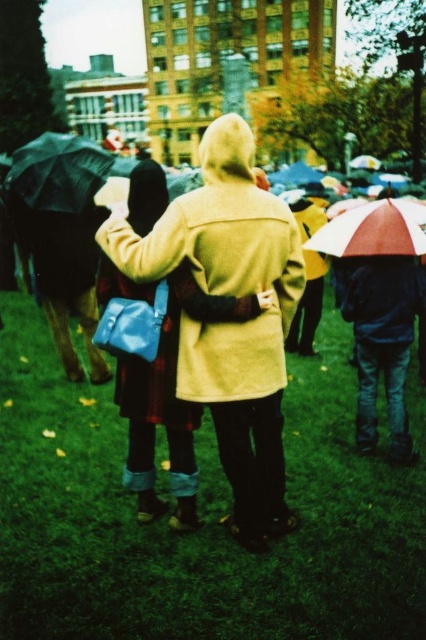
Which of these two, green grass at center or matte yellow trench coat at center, stands shorter?

Standing shorter between the two is matte yellow trench coat at center.

Does point (204, 497) lie in front of point (261, 486)?

No, (204, 497) is behind (261, 486).

Is point (8, 582) closer to viewer compared to point (166, 230)?

Yes, point (8, 582) is closer to viewer.

Identify the location of green grass at center. (201, 515).

Between matte yellow trench coat at center and translucent plastic umbrella at right, which one has more height?

Standing taller between the two is matte yellow trench coat at center.

Is matte yellow trench coat at center to the right of translucent plastic umbrella at right from the viewer's perspective?

Incorrect, matte yellow trench coat at center is not on the right side of translucent plastic umbrella at right.

Is point (154, 264) less distant than point (333, 227)?

Yes, point (154, 264) is in front of point (333, 227).

You are a GUI agent. You are given a task and a screenshot of the screen. Output one action in this format:
    pyautogui.click(x=<x>, y=<y>)
    Task: Click on the matte yellow trench coat at center
    The image size is (426, 640).
    Given the screenshot: What is the action you would take?
    pyautogui.click(x=230, y=323)

Can you confirm if green grass at center is positioned to the left of matte black umbrella at left?

Incorrect, green grass at center is not on the left side of matte black umbrella at left.

Is green grass at center below matte black umbrella at left?

Correct, green grass at center is located below matte black umbrella at left.

Which is in front, point (339, 429) or point (101, 168)?

Point (339, 429) is in front.

The image size is (426, 640). In order to click on green grass at center in this screenshot , I will do `click(201, 515)`.